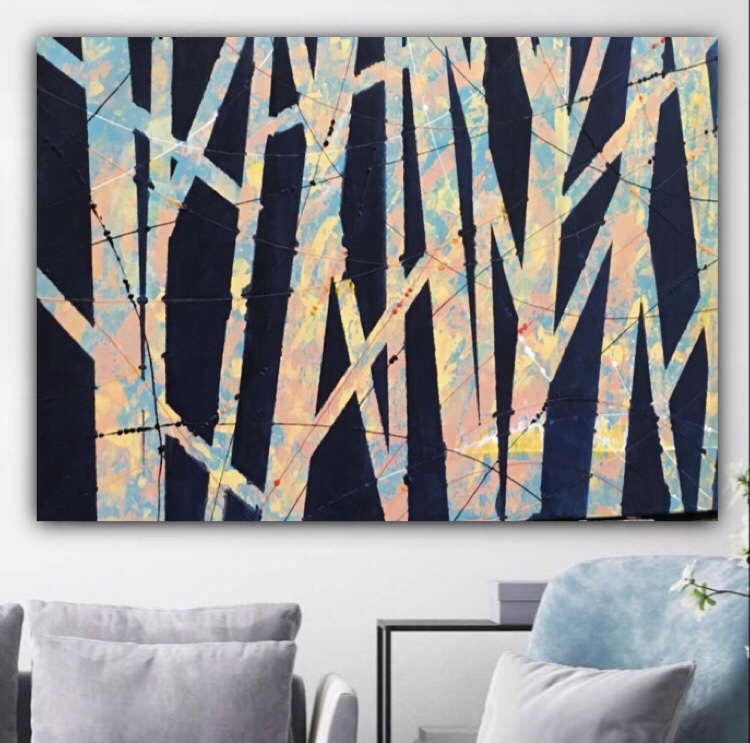
This screenshot has height=743, width=750. In order to click on picture in this screenshot , I will do `click(206, 259)`.